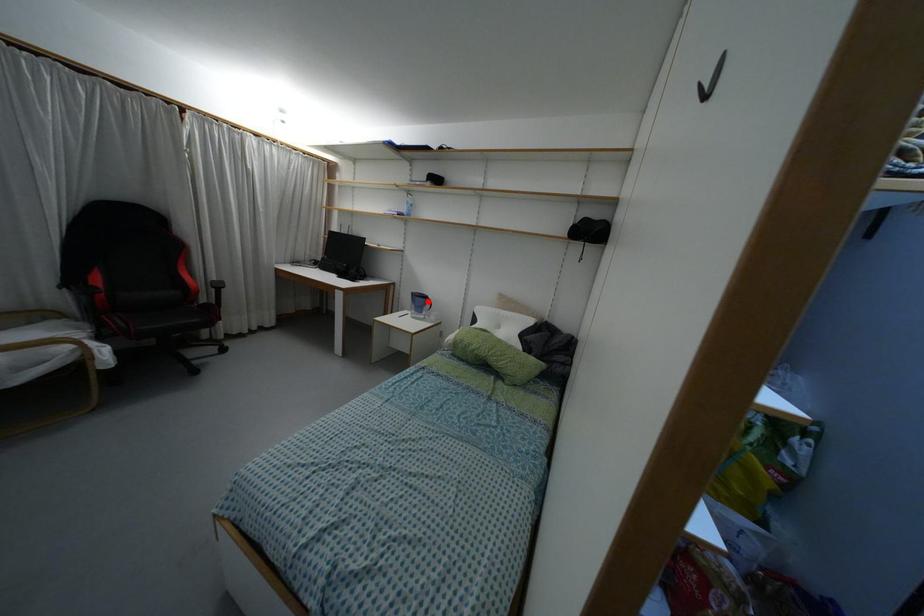
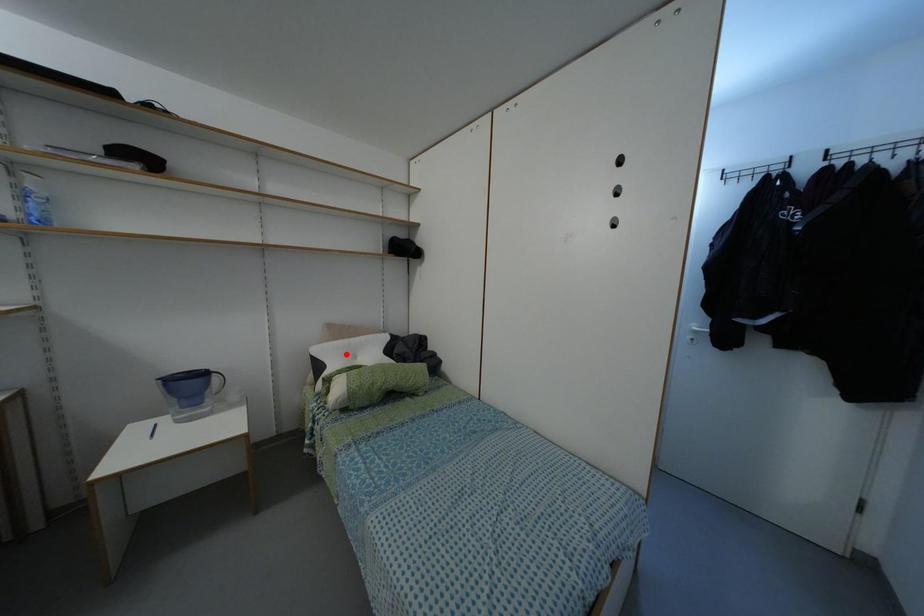
I am providing you with two images of the same scene from different viewpoints. A red point is marked on the first image and another point is marked on the second image. Do the highlighted points in image1 and image2 indicate the same real-world spot?

No